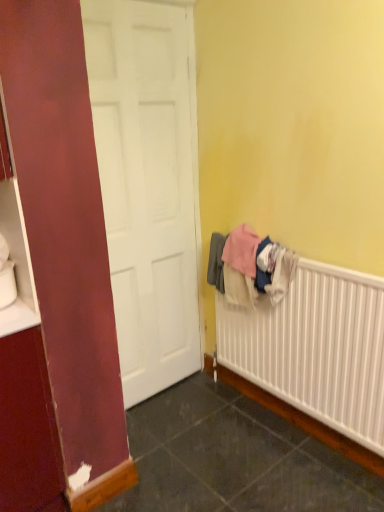
Question: Looking at the image, does white textured radiator at lower right seem bigger or smaller compared to soft cotton towels at right?

Choices:
 (A) big
 (B) small

Answer: (A)

Question: Based on their positions, is white textured radiator at lower right located to the left or right of soft cotton towels at right?

Choices:
 (A) left
 (B) right

Answer: (B)

Question: In the image, is white textured radiator at lower right positioned in front of or behind soft cotton towels at right?

Choices:
 (A) behind
 (B) front

Answer: (B)

Question: From the image's perspective, relative to white textured radiator at lower right, is soft cotton towels at right above or below?

Choices:
 (A) below
 (B) above

Answer: (B)

Question: Is point (269, 253) closer or farther from the camera than point (301, 335)?

Choices:
 (A) farther
 (B) closer

Answer: (B)

Question: Visually, is soft cotton towels at right positioned to the left or to the right of white textured radiator at lower right?

Choices:
 (A) left
 (B) right

Answer: (A)

Question: From a real-world perspective, relative to white textured radiator at lower right, is soft cotton towels at right vertically above or below?

Choices:
 (A) below
 (B) above

Answer: (B)